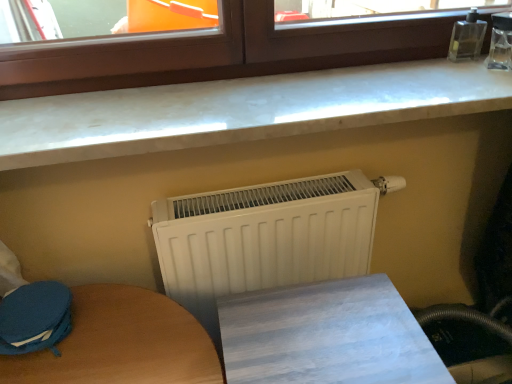
Measure the distance between point (173, 230) and camera.

Point (173, 230) and camera are 35.67 inches apart from each other.

This screenshot has width=512, height=384. What do you see at coordinates (35, 318) in the screenshot? I see `blue fabric swivel chair at lower left` at bounding box center [35, 318].

This screenshot has height=384, width=512. I want to click on blue fabric swivel chair at lower left, so click(35, 318).

At what (x,y) coordinates should I click in order to perform the action: click on wooden table at lower center. Please return your answer as a coordinate pair (x, y). The height and width of the screenshot is (384, 512). Looking at the image, I should click on (326, 336).

What do you see at coordinates (218, 52) in the screenshot? I see `brown wood window at upper center` at bounding box center [218, 52].

The image size is (512, 384). Find the location of `white matte radiator at center`. white matte radiator at center is located at coordinates (263, 238).

How much distance is there between white marble countertop at upper center and white matte radiator at center?

A distance of 24.15 centimeters exists between white marble countertop at upper center and white matte radiator at center.

Locate an element on the screen. Image resolution: width=512 pixels, height=384 pixels. radiator below the white marble countertop at upper center (from the image's perspective) is located at coordinates (263, 238).

From a real-world perspective, is white marble countertop at upper center physically located above or below white matte radiator at center?

white marble countertop at upper center is situated higher than white matte radiator at center in the real world.

Is white marble countertop at upper center facing towards white matte radiator at center?

No, white marble countertop at upper center does not turn towards white matte radiator at center.

Locate an element on the screen. The height and width of the screenshot is (384, 512). window in front of the white matte radiator at center is located at coordinates (218, 52).

Is white matte radiator at center facing away from brown wood window at upper center?

No, white matte radiator at center is not facing away from brown wood window at upper center.

Considering the relative sizes of white matte radiator at center and brown wood window at upper center in the image provided, is white matte radiator at center bigger than brown wood window at upper center?

Yes.

Between white marble countertop at upper center and wooden table at lower center, which one appears on the left side from the viewer's perspective?

→ white marble countertop at upper center.

How different are the orientations of white marble countertop at upper center and wooden table at lower center in degrees?

The angular difference between white marble countertop at upper center and wooden table at lower center is 2.99 degrees.

Between white marble countertop at upper center and wooden table at lower center, which one has less height?

With less height is white marble countertop at upper center.

From the image's perspective, does white marble countertop at upper center appear higher than wooden table at lower center?

Yes, from the image's perspective, white marble countertop at upper center is over wooden table at lower center.

Considering the sizes of objects white marble countertop at upper center and brown wood window at upper center in the image provided, who is bigger, white marble countertop at upper center or brown wood window at upper center?

brown wood window at upper center.

From the image's perspective, between white marble countertop at upper center and brown wood window at upper center, who is located below?

white marble countertop at upper center appears lower in the image.

Is brown wood window at upper center completely or partially inside white marble countertop at upper center?

No, white marble countertop at upper center does not contain brown wood window at upper center.

How many degrees apart are the facing directions of white marble countertop at upper center and brown wood window at upper center?

0.000338 degrees separate the facing orientations of white marble countertop at upper center and brown wood window at upper center.

Is white matte radiator at center facing towards white marble countertop at upper center?

No, white matte radiator at center is not oriented towards white marble countertop at upper center.

From a real-world perspective, is white matte radiator at center physically located above or below white marble countertop at upper center?

white matte radiator at center is situated lower than white marble countertop at upper center in the real world.

From the image's perspective, is white matte radiator at center located above or below white marble countertop at upper center?

From the image's perspective, white matte radiator at center appears below white marble countertop at upper center.

From the image's perspective, which is below, blue fabric swivel chair at lower left or white matte radiator at center?

From the image's view, blue fabric swivel chair at lower left is below.

Who is shorter, blue fabric swivel chair at lower left or white matte radiator at center?

With less height is blue fabric swivel chair at lower left.

Considering the sizes of objects blue fabric swivel chair at lower left and white matte radiator at center in the image provided, who is thinner, blue fabric swivel chair at lower left or white matte radiator at center?

white matte radiator at center is thinner.

In order to click on radiator above the blue fabric swivel chair at lower left (from the image's perspective) in this screenshot , I will do `click(263, 238)`.

Can you tell me how much blue fabric swivel chair at lower left and brown wood window at upper center differ in facing direction?

There is a 0.663-degree angle between the facing directions of blue fabric swivel chair at lower left and brown wood window at upper center.

From a real-world perspective, between blue fabric swivel chair at lower left and brown wood window at upper center, who is vertically higher?

brown wood window at upper center, from a real-world perspective.

Between blue fabric swivel chair at lower left and brown wood window at upper center, which one has smaller width?

brown wood window at upper center is thinner.

Is blue fabric swivel chair at lower left further to camera compared to brown wood window at upper center?

Yes.

Identify the location of radiator that appears below the white marble countertop at upper center (from the image's perspective). The height and width of the screenshot is (384, 512). 263,238.

The image size is (512, 384). There is a white matte radiator at center. What are the coordinates of `window above it (from a real-world perspective)` in the screenshot? It's located at (218, 52).

Consider the image. Considering their positions, is wooden table at lower center positioned closer to brown wood window at upper center than white marble countertop at upper center?

white marble countertop at upper center.

From the image, which object appears to be nearer to wooden table at lower center, blue fabric swivel chair at lower left or brown wood window at upper center?

blue fabric swivel chair at lower left is closer to wooden table at lower center.

Based on their spatial positions, is white matte radiator at center or wooden table at lower center closer to white marble countertop at upper center?

Based on the image, white matte radiator at center appears to be nearer to white marble countertop at upper center.

Considering their positions, is white marble countertop at upper center positioned closer to wooden table at lower center than blue fabric swivel chair at lower left?

white marble countertop at upper center lies closer to wooden table at lower center than the other object.

When comparing their distances from white matte radiator at center, does wooden table at lower center or brown wood window at upper center seem closer?

wooden table at lower center lies closer to white matte radiator at center than the other object.

Looking at the image, which one is located closer to brown wood window at upper center, blue fabric swivel chair at lower left or wooden table at lower center?

The object closer to brown wood window at upper center is blue fabric swivel chair at lower left.

Based on their spatial positions, is wooden table at lower center or white matte radiator at center closer to white marble countertop at upper center?

white matte radiator at center lies closer to white marble countertop at upper center than the other object.

Estimate the real-world distances between objects in this image. Which object is further from white matte radiator at center, blue fabric swivel chair at lower left or wooden table at lower center?

Among the two, blue fabric swivel chair at lower left is located further to white matte radiator at center.

Where is `radiator between brown wood window at upper center and blue fabric swivel chair at lower left in the up-down direction`? radiator between brown wood window at upper center and blue fabric swivel chair at lower left in the up-down direction is located at coordinates click(263, 238).

Find the location of `radiator situated between blue fabric swivel chair at lower left and white marble countertop at upper center from left to right`. radiator situated between blue fabric swivel chair at lower left and white marble countertop at upper center from left to right is located at coordinates (263, 238).

Find the location of a particular element. Image resolution: width=512 pixels, height=384 pixels. countertop between brown wood window at upper center and wooden table at lower center in the up-down direction is located at coordinates (241, 110).

Find the location of a particular element. swivel chair between brown wood window at upper center and wooden table at lower center in the vertical direction is located at coordinates (35, 318).